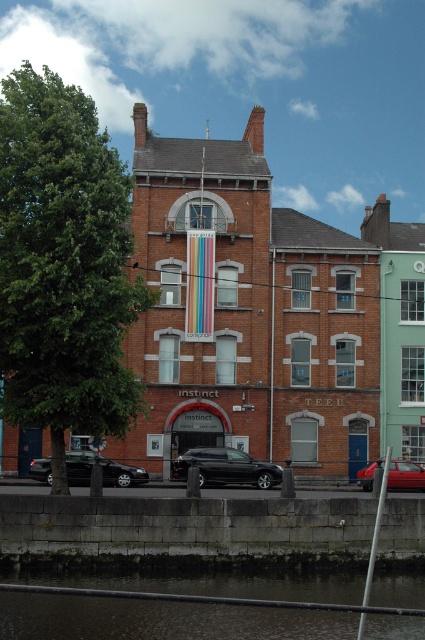
You are a delivery driver who needs to park your vehicle in this area. You have a truck that is 6 meters long. There is a shiny black car at lower center and a shiny black sedan at lower left. Can you fit your truck between them without moving any of the existing vehicles?

The shiny black car at lower center and shiny black sedan at lower left are 8.61 meters apart from each other. Since your truck is 6 meters long, you can fit your truck between them as the space is wider than the truck.

You are a delivery person who needs to park your truck next to the building. You see a shiny black sedan at lower left and a shiny red car at lower right. Which vehicle is shorter in height so that it won t block the view of the rainbow banner above the entrance?

The shiny black sedan at lower left has a lesser height compared to the shiny red car at lower right, so it won t block the view of the rainbow banner above the entrance.

Consider the image. You are a delivery driver who needs to park your vehicle in a tight space between the shiny black car at lower center and the shiny black sedan at lower left. Your vehicle is 1.8 meters tall. Can you fit your vehicle between them without hitting the roof?

The shiny black car at lower center is taller than the shiny black sedan at lower left. Since your vehicle is 1.8 meters tall, you need to ensure there is enough vertical clearance. However, the description only mentions height comparison between the two cars, not the actual height of either. Without knowing the exact height of the taller car, it is uncertain if there is sufficient space. Proceed with caution and check the available height before parking.